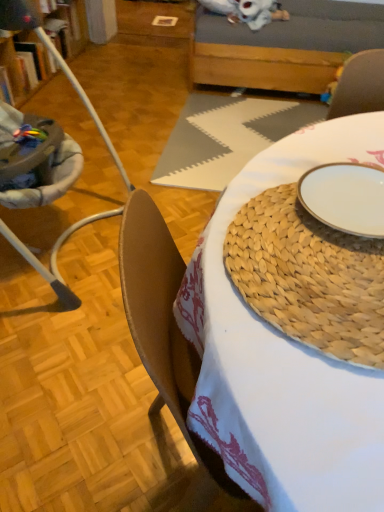
Image resolution: width=384 pixels, height=512 pixels. I want to click on vacant space situated above white ceramic plate at center (from a real-world perspective), so click(x=350, y=196).